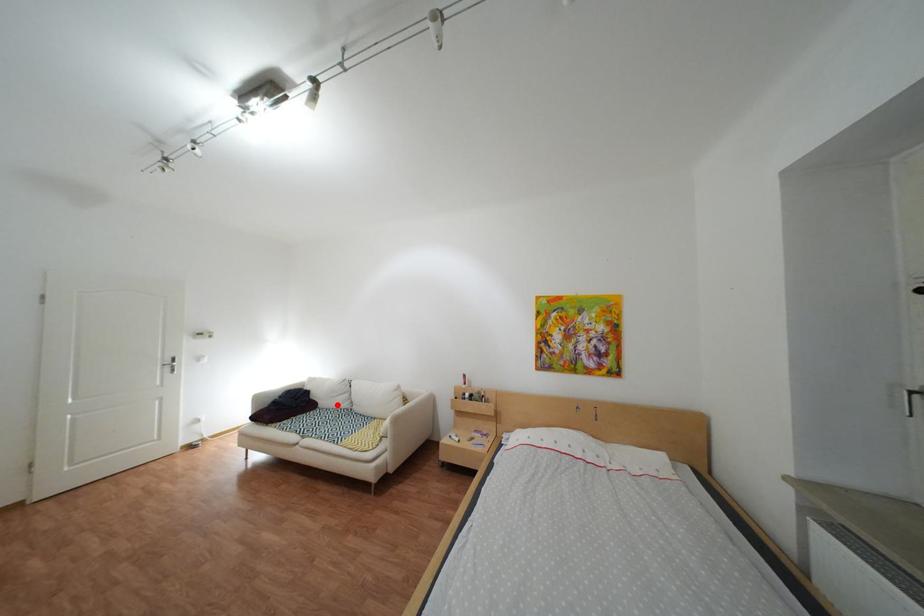
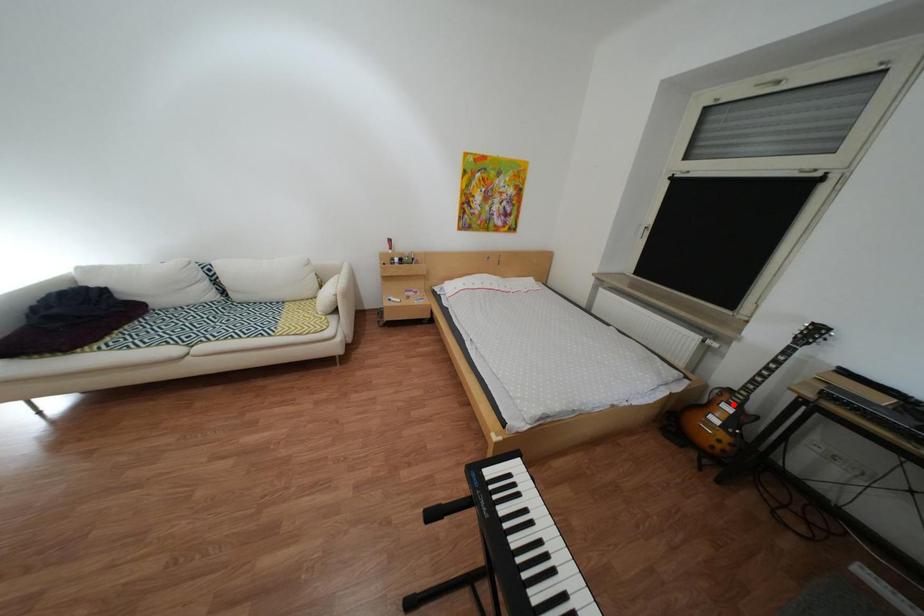
Looking at this image, I am providing you with two images of the same scene from different viewpoints. A red point is marked on the first image and another point is marked on the second image. Are the points marked in image1 and image2 representing the same 3D position?

No